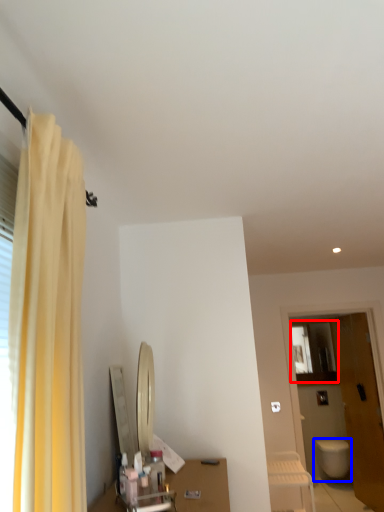
Question: Which object is further to the camera taking this photo, medicine cabinet (highlighted by a red box) or toilet (highlighted by a blue box)?

Choices:
 (A) medicine cabinet
 (B) toilet

Answer: (A)